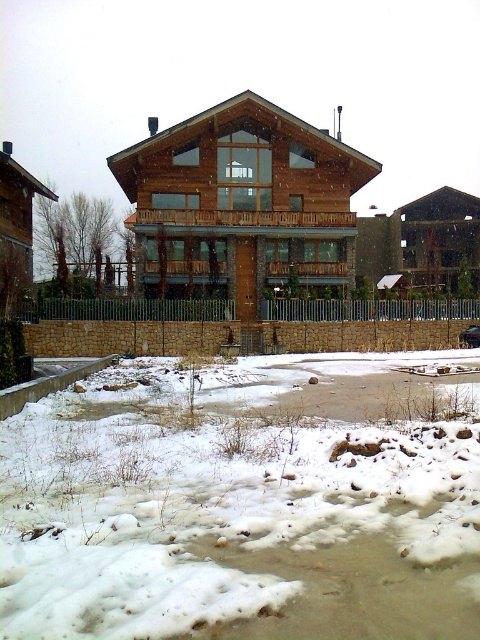
Question: In this image, where is white fluffy snow at lower center located relative to shiny black car at center?

Choices:
 (A) above
 (B) below

Answer: (B)

Question: Can you confirm if white fluffy snow at lower center is bigger than shiny black car at center?

Choices:
 (A) yes
 (B) no

Answer: (A)

Question: Is white fluffy snow at lower center thinner than shiny black car at center?

Choices:
 (A) no
 (B) yes

Answer: (A)

Question: Which point is farther to the camera?

Choices:
 (A) shiny black car at center
 (B) white fluffy snow at lower center

Answer: (A)